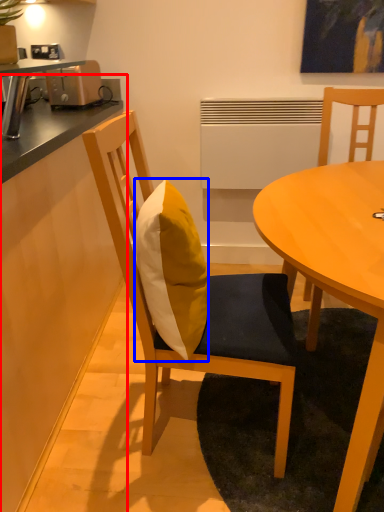
Question: Which object appears closest to the camera in this image, counter (highlighted by a red box) or pillow (highlighted by a blue box)?

Choices:
 (A) counter
 (B) pillow

Answer: (A)